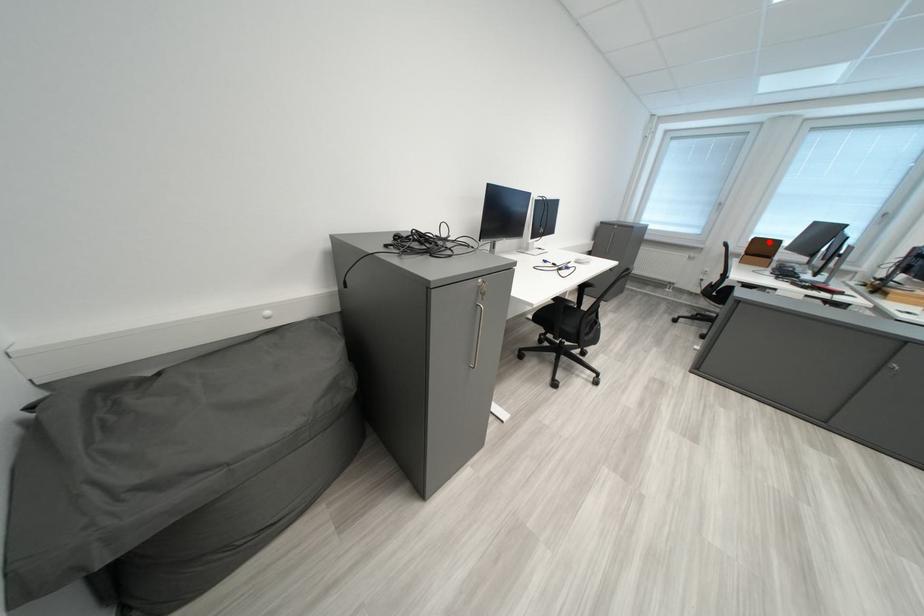
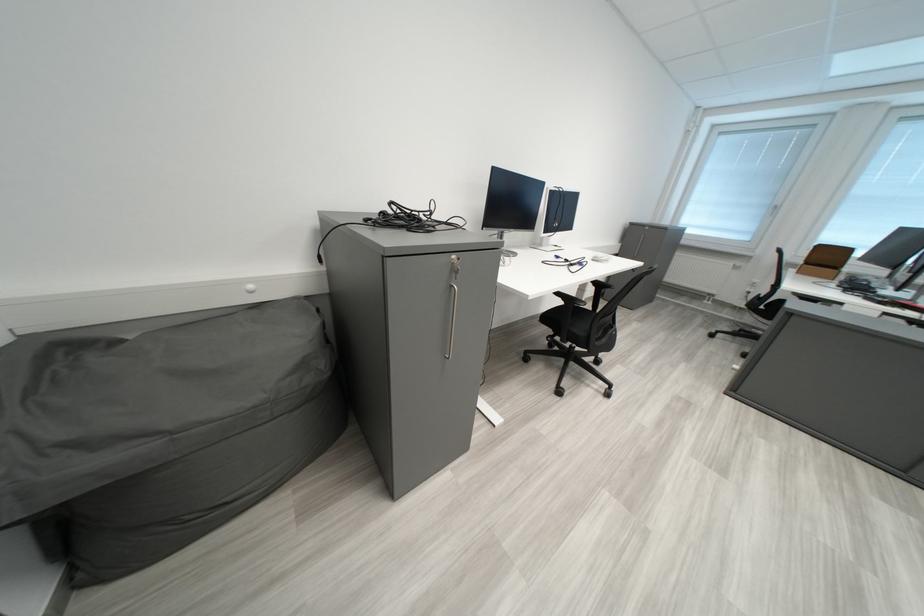
Where in the second image is the point corresponding to the highlighted location from the first image?

(833, 249)